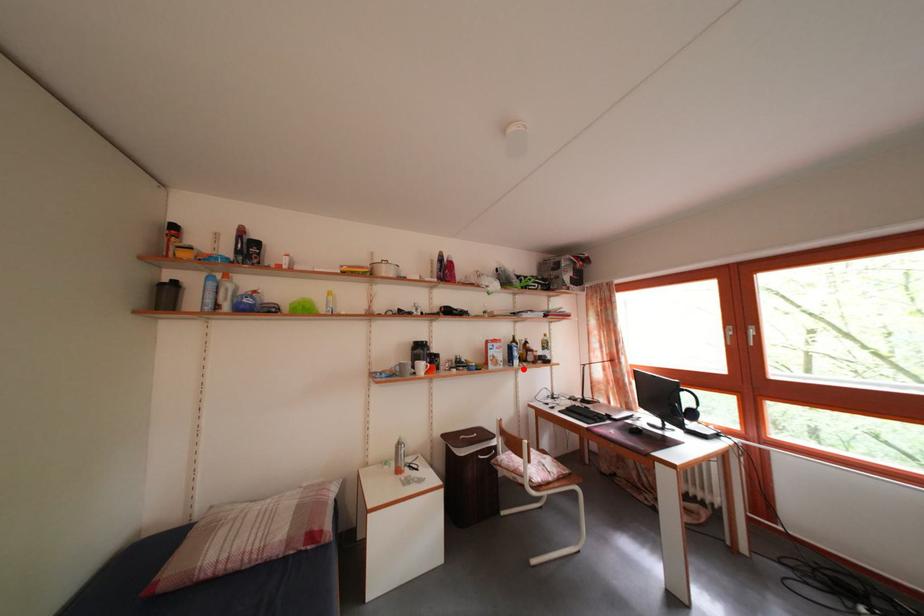
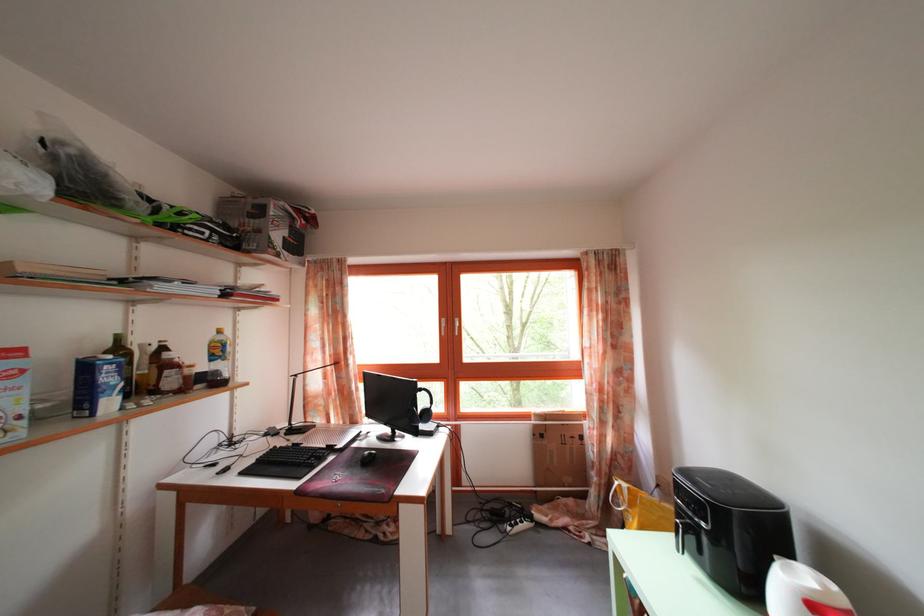
Question: I am providing you with two images of the same scene from different viewpoints. Given a red point in image1, look at the same physical point in image2. Is it:

Choices:
 (A) Closer to the viewpoint
 (B) Farther from the viewpoint

Answer: (A)